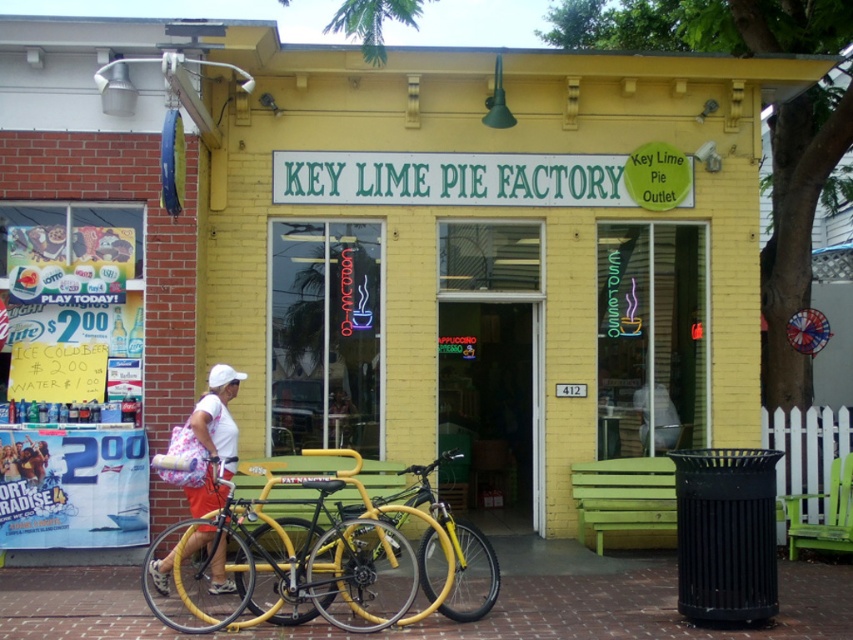
Between point (451, 605) and point (218, 506), which one is positioned behind?

Point (218, 506)

Is point (428, 490) less distant than point (231, 420)?

That is True.

The image size is (853, 640). Identify the location of yellow matte bicycle at center. (445, 548).

Can you confirm if yellow matte bicycle at lower left is positioned to the left of yellow matte bicycle at center?

Indeed, yellow matte bicycle at lower left is positioned on the left side of yellow matte bicycle at center.

Is the position of yellow matte bicycle at lower left less distant than that of yellow matte bicycle at center?

Yes.

Where is `yellow matte bicycle at lower left`? Image resolution: width=853 pixels, height=640 pixels. yellow matte bicycle at lower left is located at coordinates (210, 566).

Does yellow matte bicycle at lower left appear under white fabric bag at lower left?

Yes.

You are a GUI agent. You are given a task and a screenshot of the screen. Output one action in this format:
    pyautogui.click(x=<x>, y=<y>)
    Task: Click on the yellow matte bicycle at lower left
    
    Given the screenshot: What is the action you would take?
    pyautogui.click(x=210, y=566)

What are the coordinates of `yellow matte bicycle at lower left` in the screenshot? It's located at pos(210,566).

Image resolution: width=853 pixels, height=640 pixels. I want to click on yellow matte bicycle at lower left, so click(x=210, y=566).